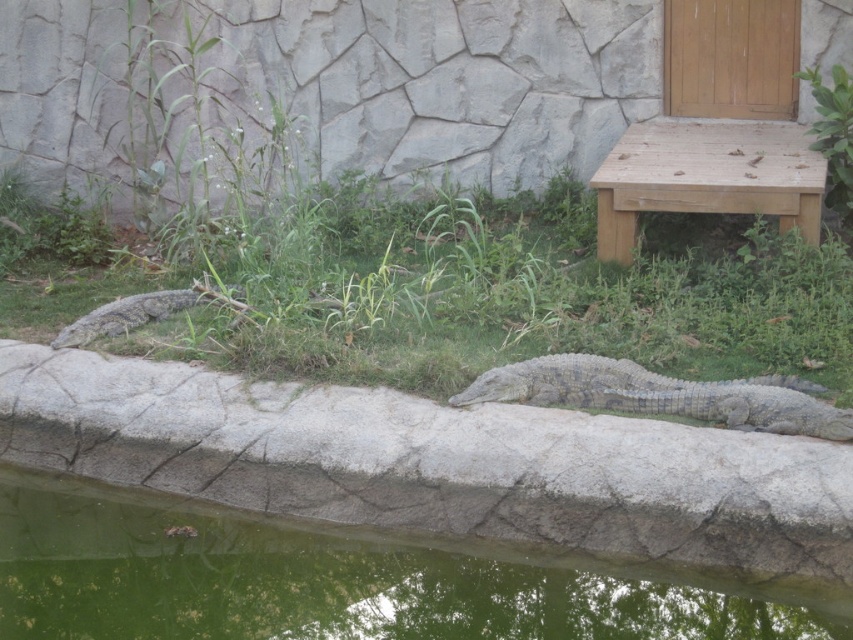
Question: Does green grass at center have a lesser width compared to wooden bench at upper right?

Choices:
 (A) yes
 (B) no

Answer: (B)

Question: Which point is farther from the camera taking this photo?

Choices:
 (A) (820, 628)
 (B) (735, 147)
 (C) (135, 320)

Answer: (B)

Question: Among these points, which one is nearest to the camera?

Choices:
 (A) (96, 316)
 (B) (816, 230)
 (C) (692, 410)

Answer: (C)

Question: Which object is positioned closest to the gray textured crocodile at left?

Choices:
 (A) gray textured crocodile at center
 (B) gray concrete wall at center
 (C) green water at bottom

Answer: (B)

Question: Does green grass at center have a greater width compared to wooden bench at upper right?

Choices:
 (A) yes
 (B) no

Answer: (A)

Question: Does gray concrete wall at center have a lesser width compared to wooden bench at upper right?

Choices:
 (A) no
 (B) yes

Answer: (A)